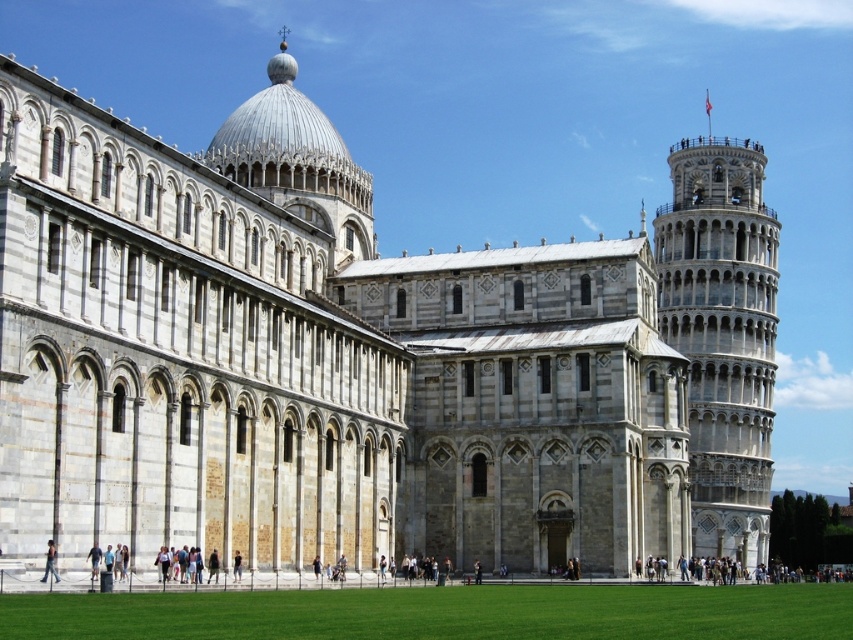
Question: Is light gray stone tower at right wider than light brown leather jacket at lower left?

Choices:
 (A) yes
 (B) no

Answer: (A)

Question: Does light gray stone tower at right have a lesser width compared to light brown leather jacket at lower left?

Choices:
 (A) yes
 (B) no

Answer: (B)

Question: Which point is closer to the camera?

Choices:
 (A) light brown leather jacket at lower left
 (B) light gray stone tower at right

Answer: (A)

Question: Can you confirm if light gray stone tower at right is wider than light brown leather jacket at lower left?

Choices:
 (A) no
 (B) yes

Answer: (B)